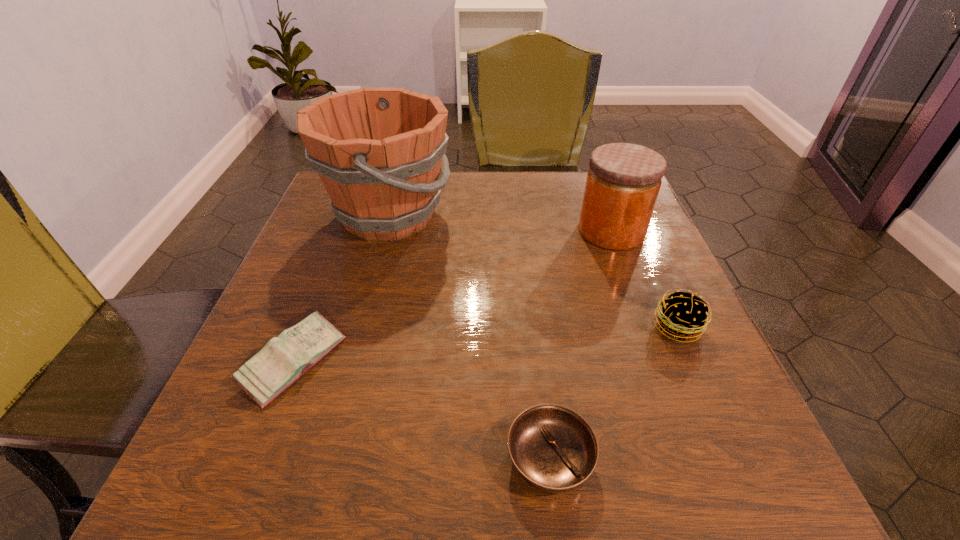
Identify the location of blank space that satisfies the following two spatial constraints: 1. on the back side of the jar; 2. on the handle side of the bucket. The image size is (960, 540). (605, 215).

Where is `free space that satisfies the following two spatial constraints: 1. on the handle side of the bucket; 2. on the right side of the third tallest object`? free space that satisfies the following two spatial constraints: 1. on the handle side of the bucket; 2. on the right side of the third tallest object is located at coordinates (358, 327).